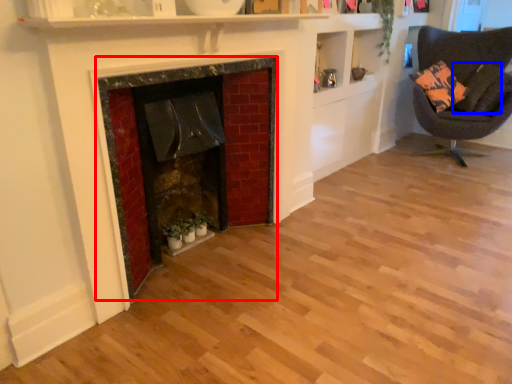
Question: Which object is closer to the camera taking this photo, fireplace (highlighted by a red box) or pillow (highlighted by a blue box)?

Choices:
 (A) fireplace
 (B) pillow

Answer: (A)